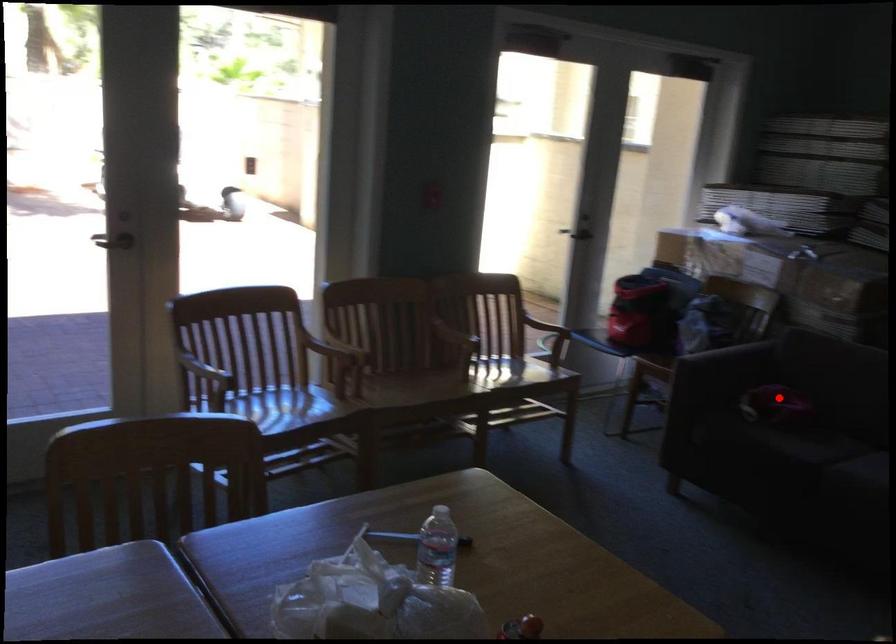
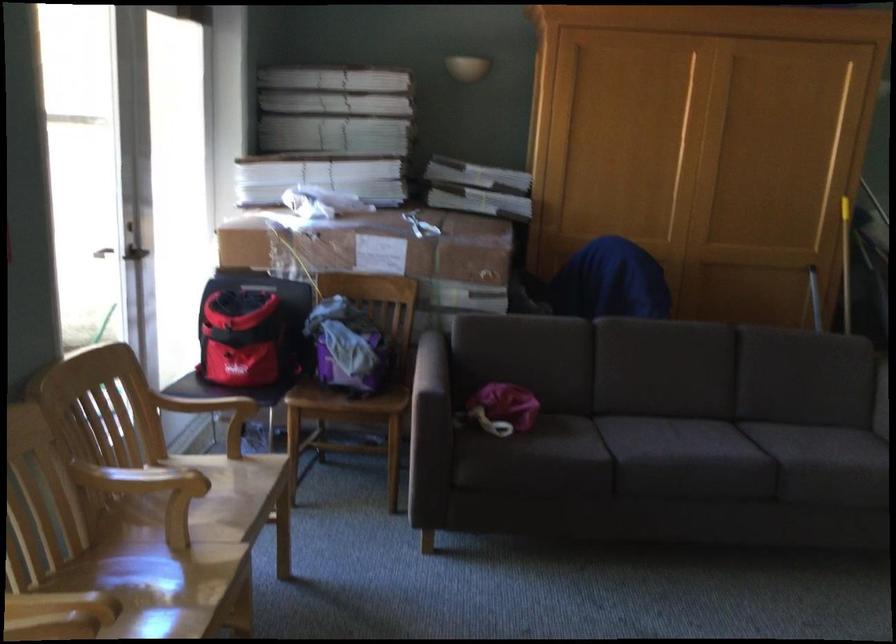
Question: I am providing you with two images of the same scene from different viewpoints. A red point is shown in image1. For the corresponding object point in image2, is it positioned nearer or farther from the camera?

Choices:
 (A) Nearer
 (B) Farther

Answer: (A)